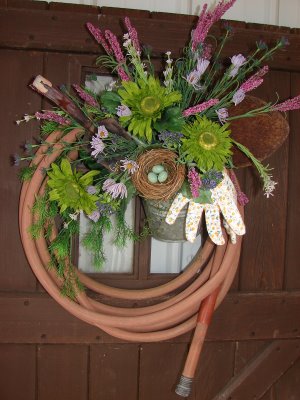
In order to click on 2 windows in this screenshot , I will do `click(112, 265)`, `click(175, 260)`.